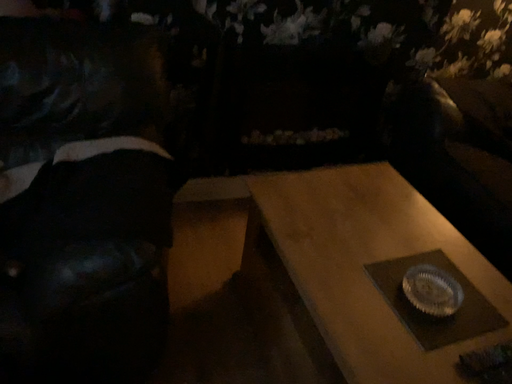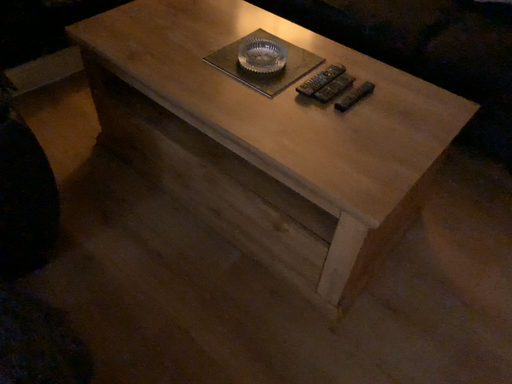
Question: How did the camera likely rotate when shooting the video?

Choices:
 (A) rotated right
 (B) rotated left

Answer: (A)